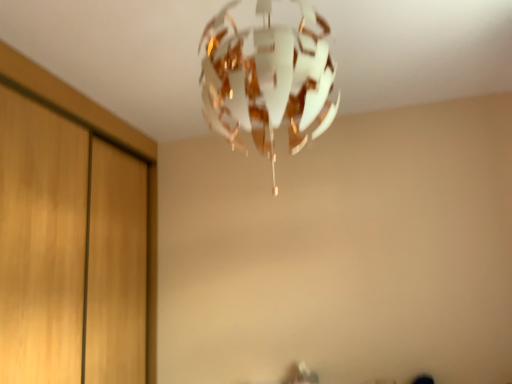
Question: Does wooden dresser at left have a larger size compared to white paper lamp at upper center?

Choices:
 (A) no
 (B) yes

Answer: (B)

Question: Can we say wooden dresser at left lies outside white paper lamp at upper center?

Choices:
 (A) yes
 (B) no

Answer: (A)

Question: From a real-world perspective, is wooden dresser at left located higher than white paper lamp at upper center?

Choices:
 (A) no
 (B) yes

Answer: (A)

Question: Is white paper lamp at upper center at the back of wooden dresser at left?

Choices:
 (A) yes
 (B) no

Answer: (B)

Question: Is wooden dresser at left taller than white paper lamp at upper center?

Choices:
 (A) no
 (B) yes

Answer: (B)

Question: Can white paper lamp at upper center be found inside wooden dresser at left?

Choices:
 (A) no
 (B) yes

Answer: (A)

Question: Considering the relative sizes of white paper lamp at upper center and wooden dresser at left in the image provided, is white paper lamp at upper center smaller than wooden dresser at left?

Choices:
 (A) yes
 (B) no

Answer: (A)

Question: From the image's perspective, is white paper lamp at upper center below wooden dresser at left?

Choices:
 (A) yes
 (B) no

Answer: (B)

Question: Does white paper lamp at upper center have a greater width compared to wooden dresser at left?

Choices:
 (A) no
 (B) yes

Answer: (B)

Question: Is white paper lamp at upper center positioned beyond the bounds of wooden dresser at left?

Choices:
 (A) yes
 (B) no

Answer: (A)

Question: From the image's perspective, is white paper lamp at upper center on top of wooden dresser at left?

Choices:
 (A) no
 (B) yes

Answer: (B)

Question: Is white paper lamp at upper center at the left side of wooden dresser at left?

Choices:
 (A) yes
 (B) no

Answer: (B)

Question: From the image's perspective, is white paper lamp at upper center positioned above or below wooden dresser at left?

Choices:
 (A) above
 (B) below

Answer: (A)